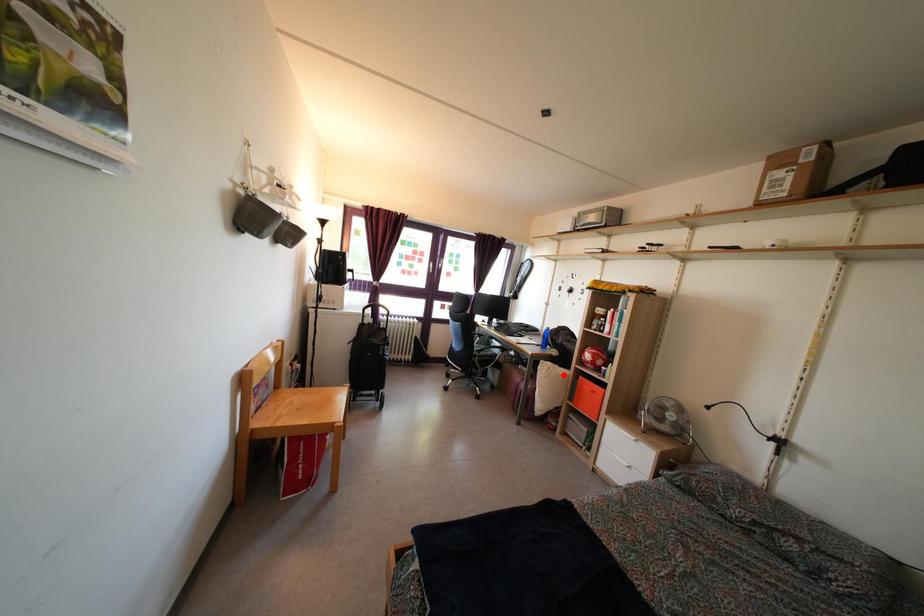
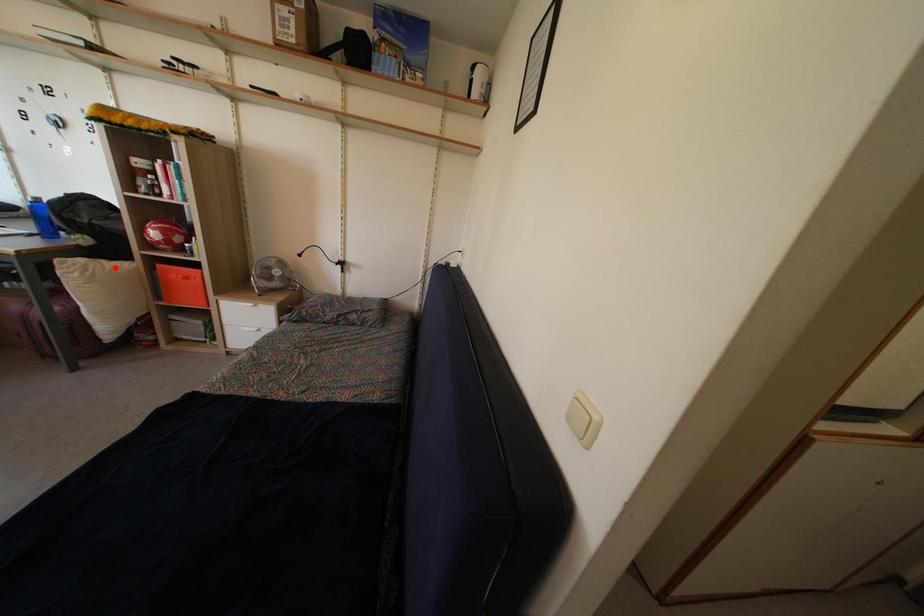
I am providing you with two images of the same scene from different viewpoints. A red point is marked on the first image and another point is marked on the second image. Is the red point in image1 aligned with the point shown in image2?

Yes